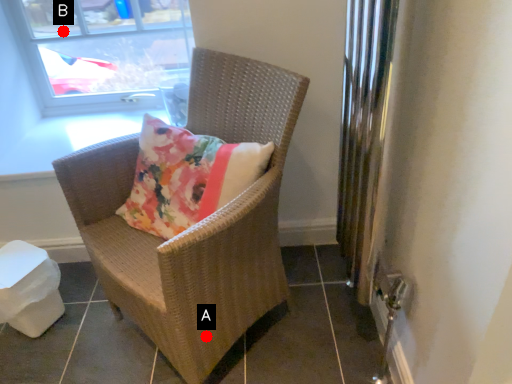
Question: Two points are circled on the image, labeled by A and B beside each circle. Which point is farther to the camera?

Choices:
 (A) A is further
 (B) B is further

Answer: (B)